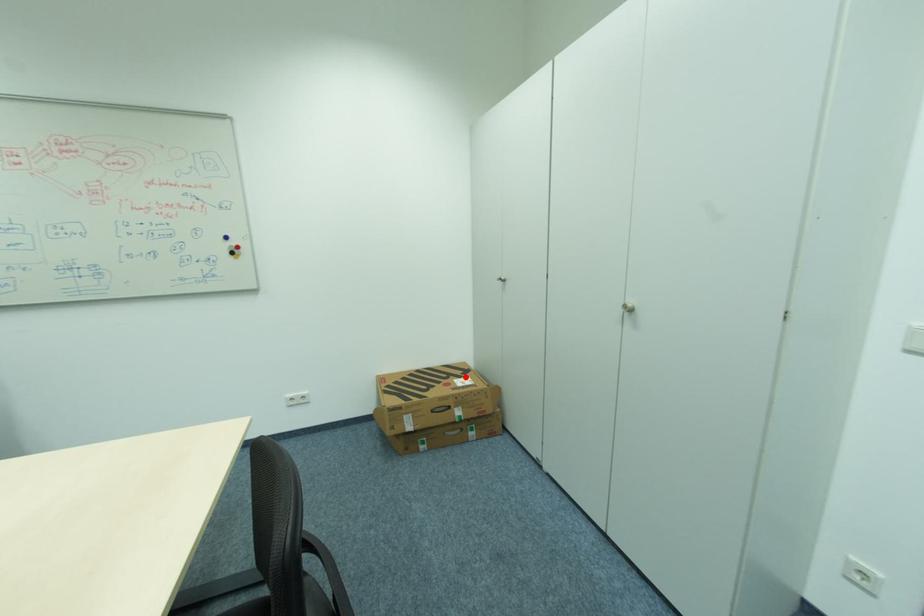
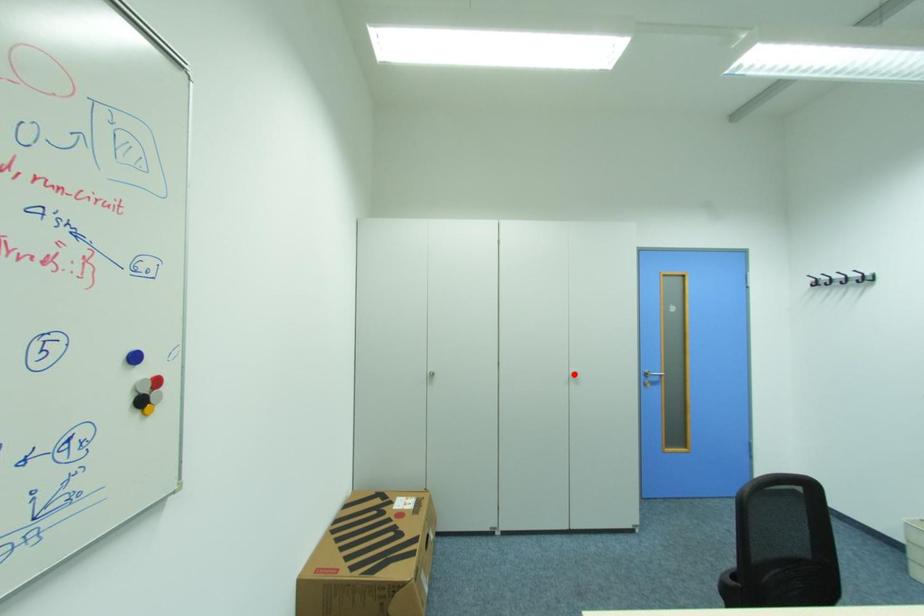
I am providing you with two images of the same scene from different viewpoints. A red point is marked on the first image and another point is marked on the second image. Do the highlighted points in image1 and image2 indicate the same real-world spot?

No